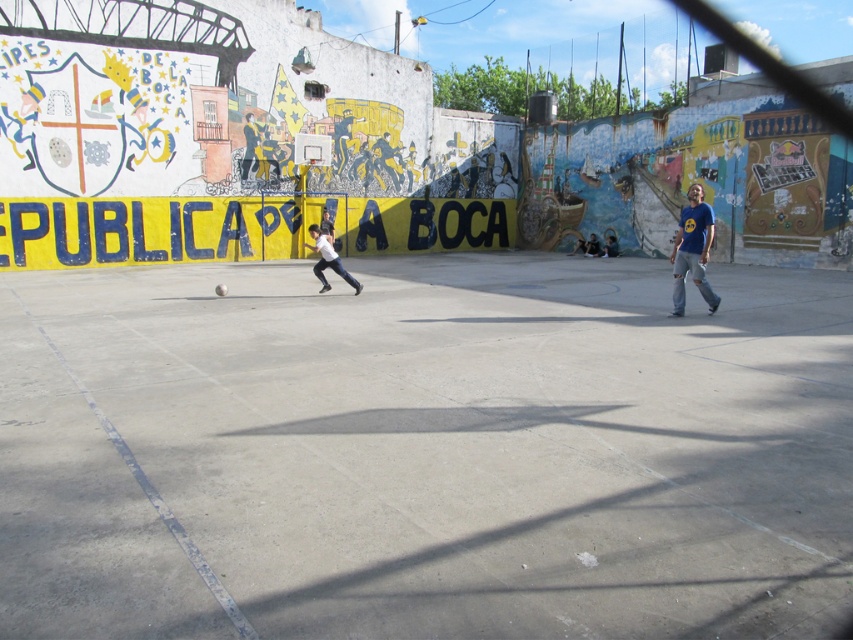
Question: Does blue t-shirt at right appear under white matte skateboard at center?

Choices:
 (A) no
 (B) yes

Answer: (B)

Question: Which object is farther from the camera taking this photo?

Choices:
 (A) concrete at center
 (B) blue t-shirt at right

Answer: (B)

Question: Among these points, which one is nearest to the camera?

Choices:
 (A) (202, 476)
 (B) (683, 252)

Answer: (A)

Question: Does concrete at center appear over white matte skateboard at center?

Choices:
 (A) yes
 (B) no

Answer: (B)

Question: Which is farther from the concrete at center?

Choices:
 (A) white matte skateboard at center
 (B) blue t-shirt at right

Answer: (B)

Question: Is concrete at center further to camera compared to white matte skateboard at center?

Choices:
 (A) yes
 (B) no

Answer: (B)